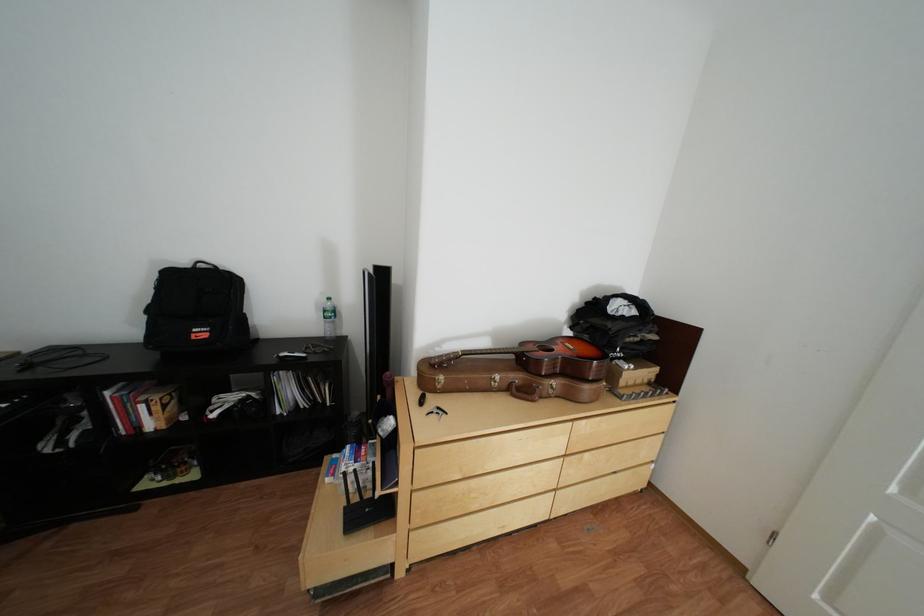
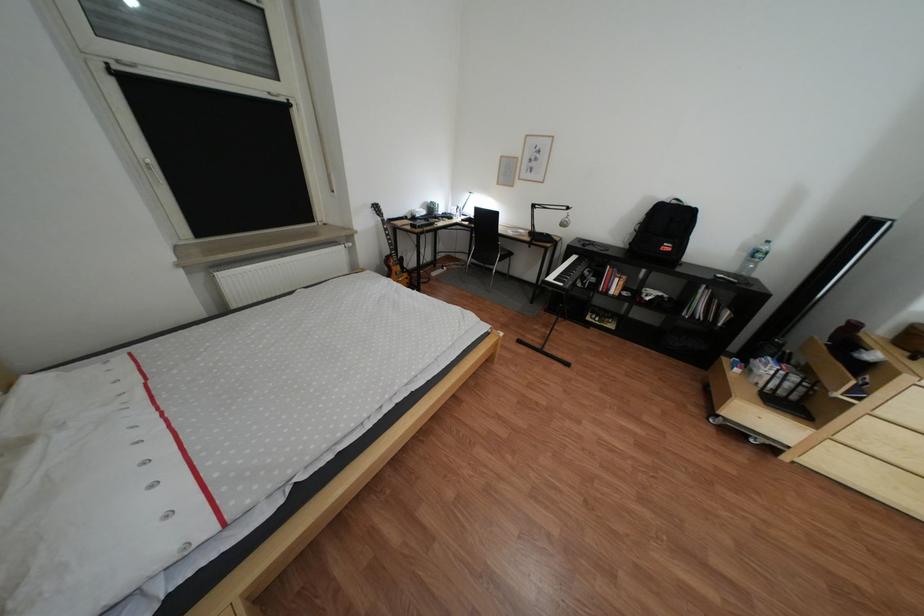
Locate, in the second image, the point that corresponds to the point at 43,368 in the first image.

(600, 246)